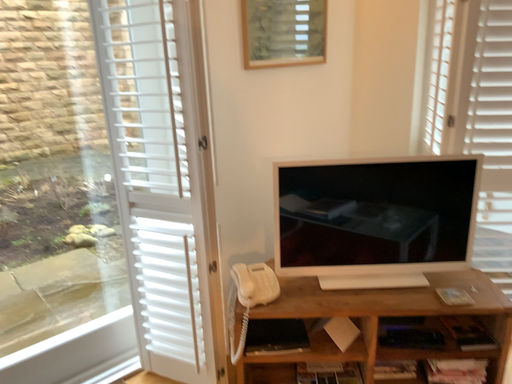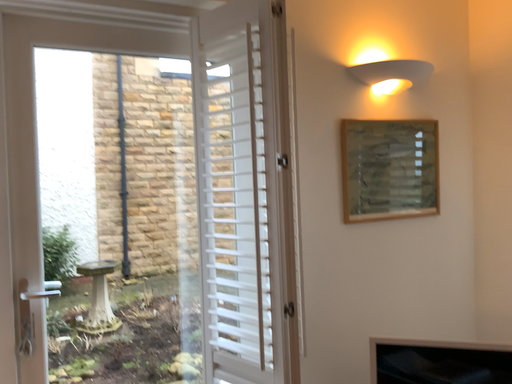
Question: Which way did the camera rotate in the video?

Choices:
 (A) rotated left
 (B) rotated right

Answer: (A)